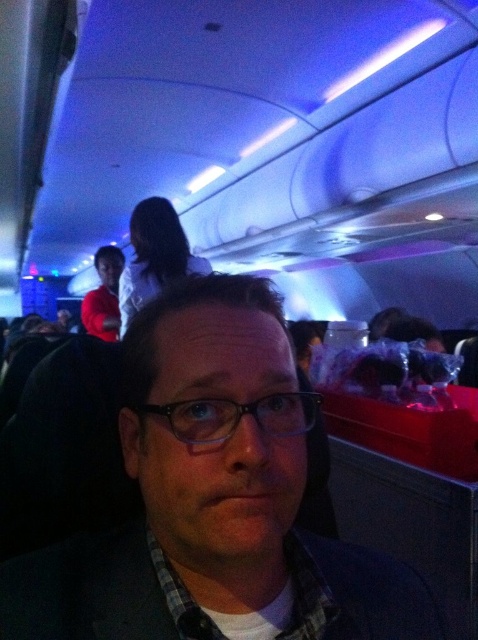
Does matte black glasses at center appear on the right side of matte red shirt at left?

Indeed, matte black glasses at center is positioned on the right side of matte red shirt at left.

In the scene shown: Does matte black glasses at center have a larger size compared to matte red shirt at left?

Correct, matte black glasses at center is larger in size than matte red shirt at left.

At what (x,y) coordinates should I click in order to perform the action: click on matte black glasses at center. Please return your answer as a coordinate pair (x, y). This screenshot has height=640, width=478. Looking at the image, I should click on (206, 499).

Which is above, black plastic glasses at center or matte red shirt at left?

Positioned higher is matte red shirt at left.

Is point (295, 432) behind point (112, 308)?

That is False.

Where is `black plastic glasses at center`? black plastic glasses at center is located at coordinates (238, 416).

This screenshot has width=478, height=640. What do you see at coordinates (206, 499) in the screenshot?
I see `matte black glasses at center` at bounding box center [206, 499].

Between matte black glasses at center and black plastic glasses at center, which one appears on the left side from the viewer's perspective?

From the viewer's perspective, matte black glasses at center appears more on the left side.

Between point (197, 333) and point (221, 429), which one is positioned behind?

The point (197, 333) is more distant.

I want to click on matte black glasses at center, so click(x=206, y=499).